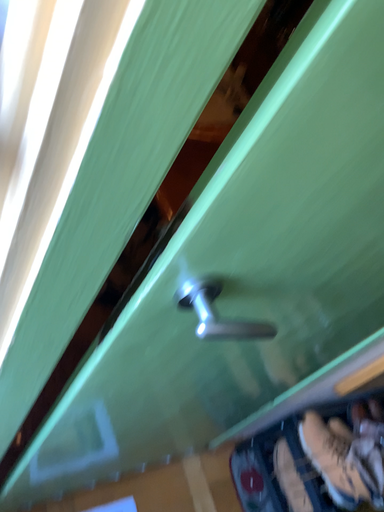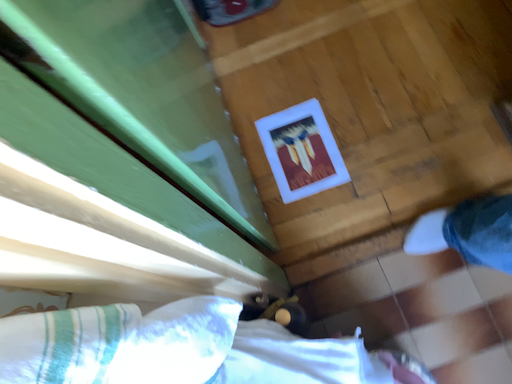
Question: Which way did the camera rotate in the video?

Choices:
 (A) rotated right
 (B) rotated left

Answer: (A)